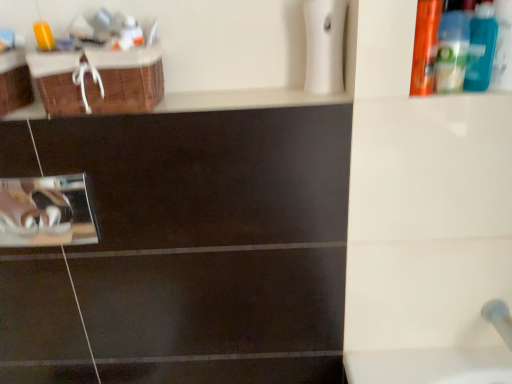
Question: From the image's perspective, is blue plastic bottle at upper right, the fourth mouthwash in the left-to-right sequence, on top of blue plastic bottle at upper right, the 2th mouthwash when ordered from right to left?

Choices:
 (A) no
 (B) yes

Answer: (B)

Question: Is blue plastic bottle at upper right, arranged as the first mouthwash when viewed from the right, closer to the viewer compared to blue plastic bottle at upper right, the 2th mouthwash when ordered from right to left?

Choices:
 (A) yes
 (B) no

Answer: (A)

Question: From a real-world perspective, is blue plastic bottle at upper right, the fourth mouthwash in the left-to-right sequence, physically below blue plastic bottle at upper right, the 2th mouthwash when ordered from right to left?

Choices:
 (A) yes
 (B) no

Answer: (B)

Question: Considering the relative sizes of blue plastic bottle at upper right, arranged as the first mouthwash when viewed from the right, and blue plastic bottle at upper right, the 2th mouthwash when ordered from right to left, in the image provided, is blue plastic bottle at upper right, arranged as the first mouthwash when viewed from the right, shorter than blue plastic bottle at upper right, the 2th mouthwash when ordered from right to left,?

Choices:
 (A) no
 (B) yes

Answer: (A)

Question: Can you confirm if blue plastic bottle at upper right, the fourth mouthwash in the left-to-right sequence, is wider than blue plastic bottle at upper right, the 2th mouthwash when ordered from right to left?

Choices:
 (A) yes
 (B) no

Answer: (B)

Question: Considering the positions of point (425, 13) and point (479, 51), is point (425, 13) closer or farther from the camera than point (479, 51)?

Choices:
 (A) closer
 (B) farther

Answer: (A)

Question: From the image's perspective, is orange plastic bottle at upper right, the second mouthwash when ordered from left to right, located above or below blue plastic bottle at upper right, arranged as the first mouthwash when viewed from the right?

Choices:
 (A) below
 (B) above

Answer: (A)

Question: In terms of width, does orange plastic bottle at upper right, the second mouthwash when ordered from left to right, look wider or thinner when compared to blue plastic bottle at upper right, arranged as the first mouthwash when viewed from the right?

Choices:
 (A) wide
 (B) thin

Answer: (B)

Question: Would you say orange plastic bottle at upper right, which is the third mouthwash in right-to-left order, is to the left or to the right of blue plastic bottle at upper right, arranged as the first mouthwash when viewed from the right, in the picture?

Choices:
 (A) left
 (B) right

Answer: (A)

Question: From a real-world perspective, is blue plastic bottle at upper right, the third mouthwash in the left-to-right sequence, above or below brown woven basket at upper left?

Choices:
 (A) above
 (B) below

Answer: (A)

Question: In terms of width, does blue plastic bottle at upper right, the 2th mouthwash when ordered from right to left, look wider or thinner when compared to brown woven basket at upper left?

Choices:
 (A) wide
 (B) thin

Answer: (B)

Question: Is blue plastic bottle at upper right, the third mouthwash in the left-to-right sequence, to the left or to the right of brown woven basket at upper left in the image?

Choices:
 (A) right
 (B) left

Answer: (A)

Question: From their relative heights in the image, would you say blue plastic bottle at upper right, the third mouthwash in the left-to-right sequence, is taller or shorter than brown woven basket at upper left?

Choices:
 (A) tall
 (B) short

Answer: (A)

Question: Relative to translucent plastic mouthwash at upper left, which ranks as the first mouthwash in left-to-right order, is brown woven basket at upper left in front or behind?

Choices:
 (A) front
 (B) behind

Answer: (A)

Question: Which is correct: brown woven basket at upper left is inside translucent plastic mouthwash at upper left, positioned as the fourth mouthwash in right-to-left order, or outside of it?

Choices:
 (A) inside
 (B) outside

Answer: (B)